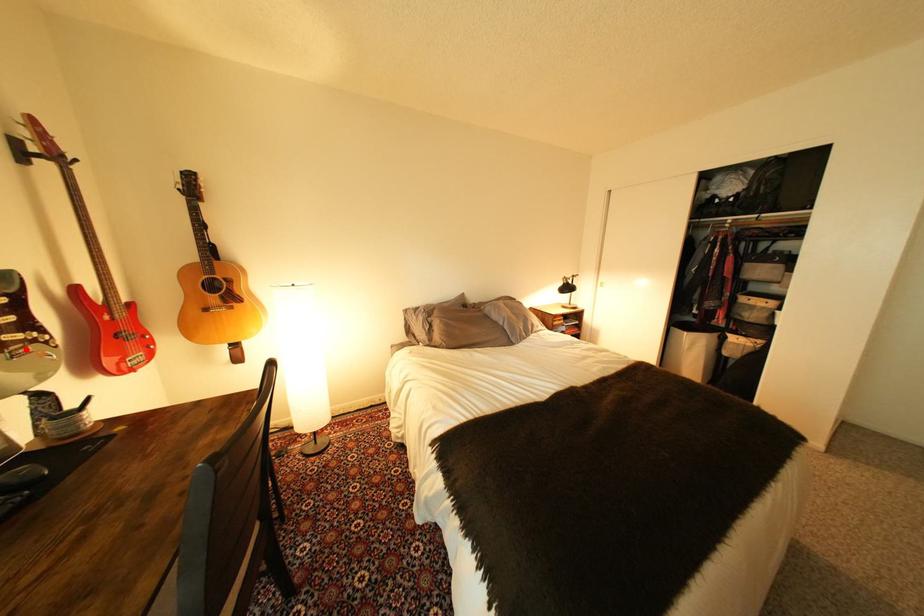
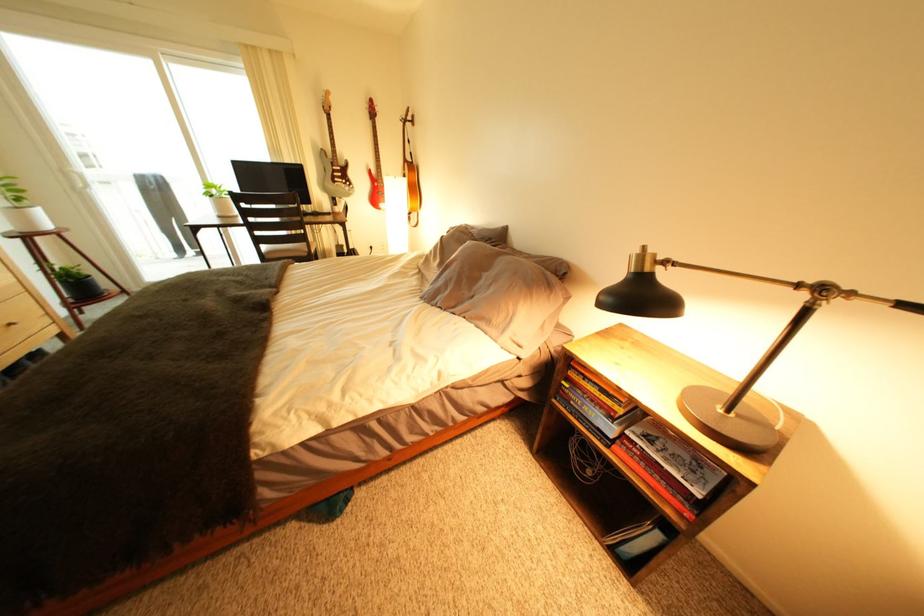
Locate, in the second image, the point that corresponds to the highlighted location in the first image.

(349, 185)